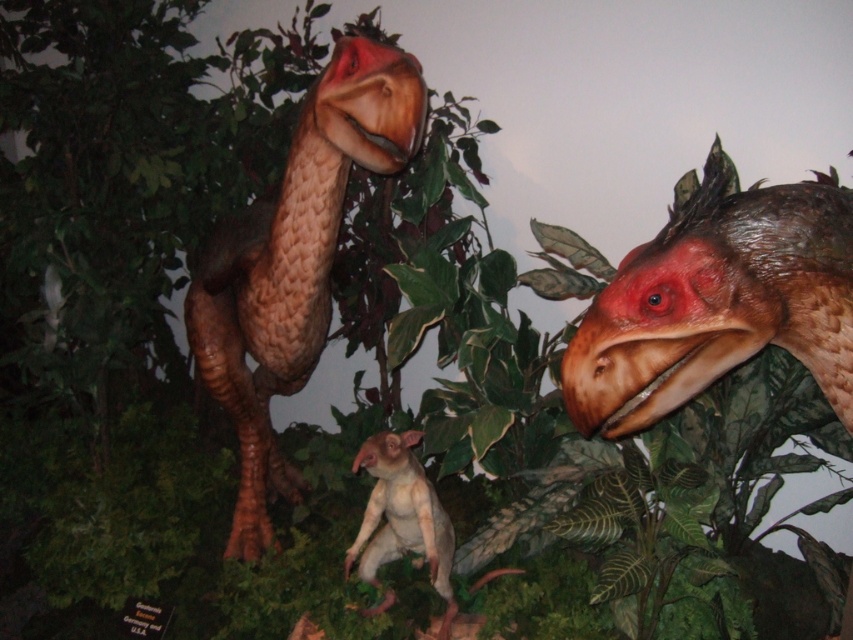
Question: Does brown textured dinosaur head at upper right appear over brown textured dinosaur at center?

Choices:
 (A) yes
 (B) no

Answer: (B)

Question: Where is brown textured dinosaur head at upper right located in relation to smooth beige animal at center in the image?

Choices:
 (A) right
 (B) left

Answer: (A)

Question: Which point is closer to the camera?

Choices:
 (A) (357, 97)
 (B) (700, 316)

Answer: (B)

Question: Does brown textured dinosaur head at upper right have a lesser width compared to brown textured dinosaur at center?

Choices:
 (A) no
 (B) yes

Answer: (B)

Question: Based on their relative distances, which object is farther from the smooth beige animal at center?

Choices:
 (A) brown textured dinosaur at center
 (B) brown textured dinosaur head at upper right

Answer: (B)

Question: Which object is the farthest from the brown textured dinosaur head at upper right?

Choices:
 (A) brown textured dinosaur at center
 (B) smooth beige animal at center

Answer: (B)